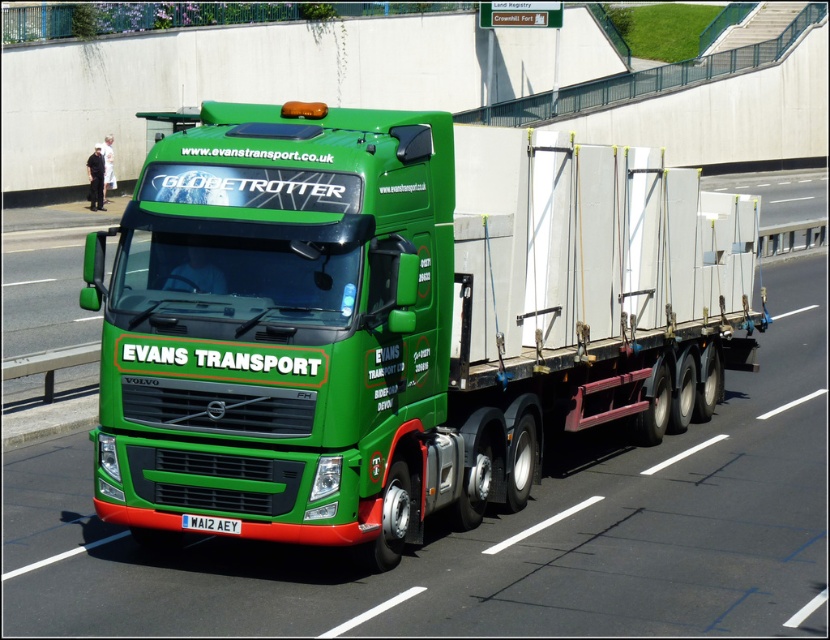
Can you confirm if green matte truck at center is smaller than white plastic license plate at center?

Correct, green matte truck at center occupies less space than white plastic license plate at center.

What do you see at coordinates (398, 317) in the screenshot?
I see `green matte truck at center` at bounding box center [398, 317].

The height and width of the screenshot is (640, 830). What are the coordinates of `green matte truck at center` in the screenshot? It's located at (398, 317).